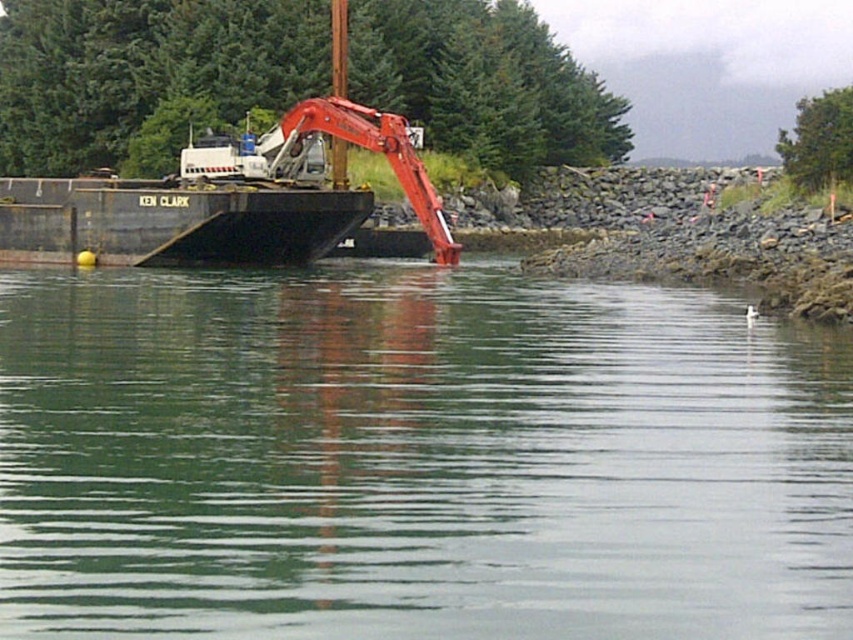
Can you confirm if green smooth water at center is taller than matte red excavator at center?

In fact, green smooth water at center may be shorter than matte red excavator at center.

Who is more forward, (637, 412) or (285, 150)?

Point (637, 412)

Is point (498, 435) in front of point (349, 125)?

Yes, point (498, 435) is closer to viewer.

Identify the location of green smooth water at center. Image resolution: width=853 pixels, height=640 pixels. (415, 458).